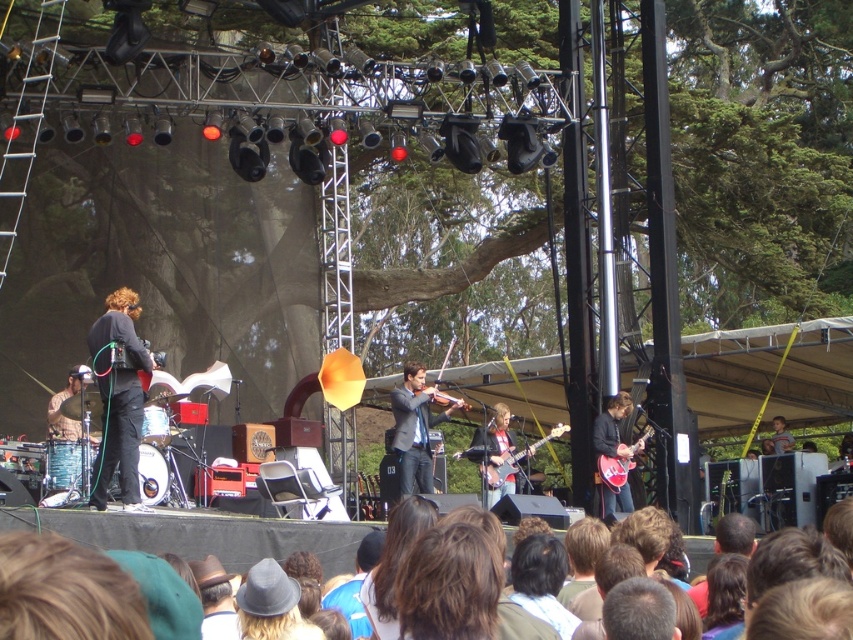
Does matte pink guitar at center appear on the right side of matte black electric guitar at center?

Indeed, matte pink guitar at center is positioned on the right side of matte black electric guitar at center.

Which is below, matte pink guitar at center or matte black electric guitar at center?

matte black electric guitar at center is lower down.

Between point (611, 497) and point (514, 454), which one is positioned behind?

Point (514, 454)

The image size is (853, 640). I want to click on matte pink guitar at center, so click(x=613, y=452).

Based on the photo, is matte black electric guitar at center to the left of wooden violin at center from the viewer's perspective?

Incorrect, matte black electric guitar at center is not on the left side of wooden violin at center.

Identify the location of matte black electric guitar at center. point(515,458).

Locate an element on the screen. The height and width of the screenshot is (640, 853). matte black electric guitar at center is located at coordinates (515, 458).

In order to click on matte red electric guitar at center right in this screenshot , I will do `click(613, 470)`.

Does matte red electric guitar at center right have a smaller size compared to wooden violin at center?

Yes.

This screenshot has width=853, height=640. Describe the element at coordinates (613, 470) in the screenshot. I see `matte red electric guitar at center right` at that location.

Find the location of a particular element. The height and width of the screenshot is (640, 853). matte red electric guitar at center right is located at coordinates (613, 470).